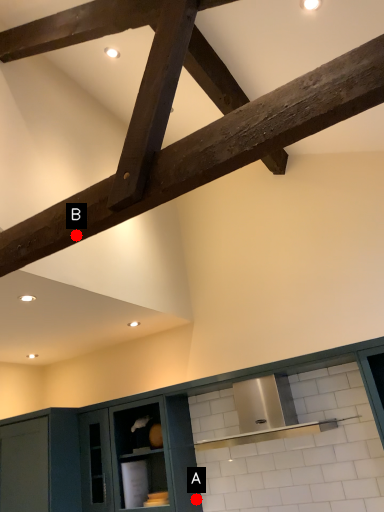
Question: Two points are circled on the image, labeled by A and B beside each circle. Which point is further to the camera?

Choices:
 (A) A is further
 (B) B is further

Answer: (A)